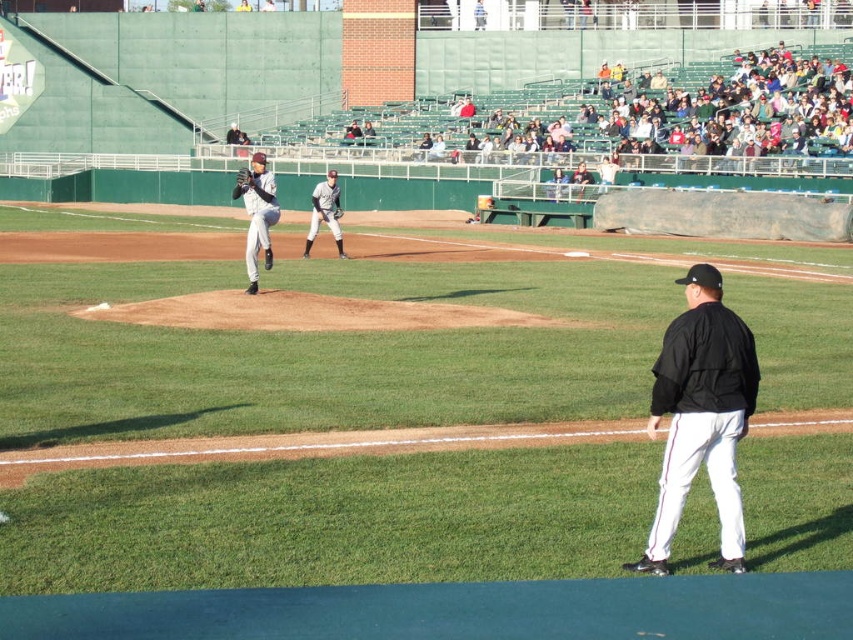
You are a photographer standing at the center of the baseball field. You want to take a photo of the gray uniformed player at center. Where should you point your camera to capture them in the frame?

The gray uniformed player at center is located at the 2D coordinates point (325, 212), so you should point your camera towards that position to capture them in the frame.

You are a drone operator trying to capture a close shot of the gray uniformed pitcher at center. The stadium has a rule that the drone must stay at least 0.3 meters away from any player. Given that the point coordinates are normalized between 0 and 1, can you safely fly the drone to the point at coordinates (x=257, y=214)?

The point at coordinates (x=257, y=214) corresponds to the gray uniformed pitcher at center. Since the drone must stay at least 0.3 meters away from any player, it would be unsafe to fly the drone to that exact point as it would be too close to the pitcher.

From the picture: You are a drone operator trying to capture a closeup shot of the gray uniformed pitcher at center. The drone has a maximum effective range of 15 meters. Can the drone get close enough to film the pitcher?

The gray uniformed pitcher at center is 16.98 meters away from the viewer, which is beyond the drone operator drone has a maximum effective range of 15 meters. Therefore, the drone cannot get close enough to film the pitcher.